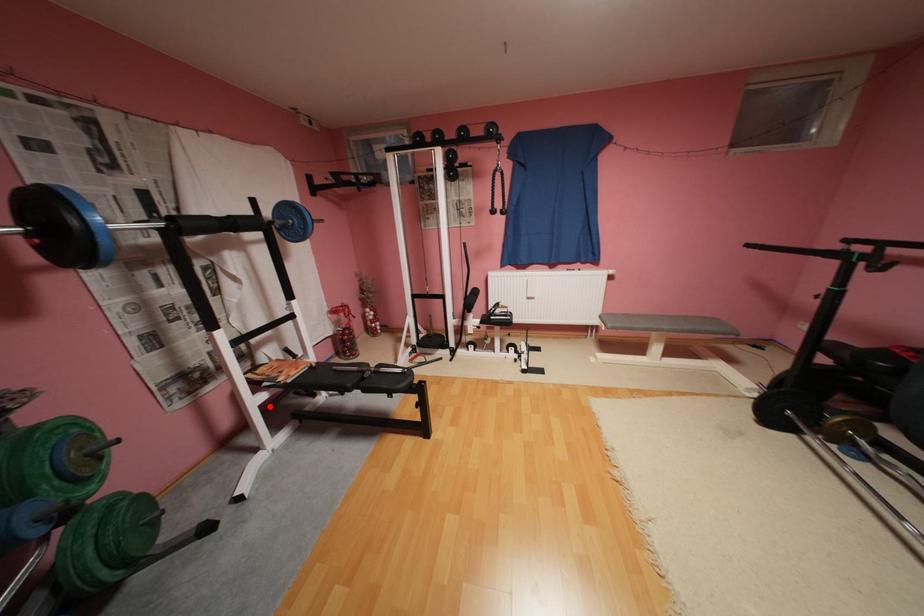
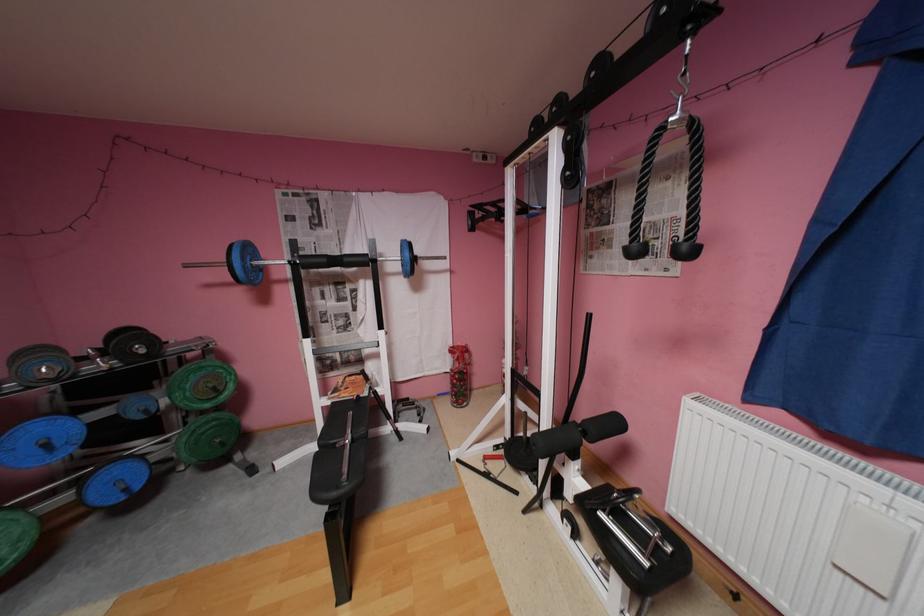
Where in the second image is the point corresponding to the highlighted location from the first image?

(333, 408)